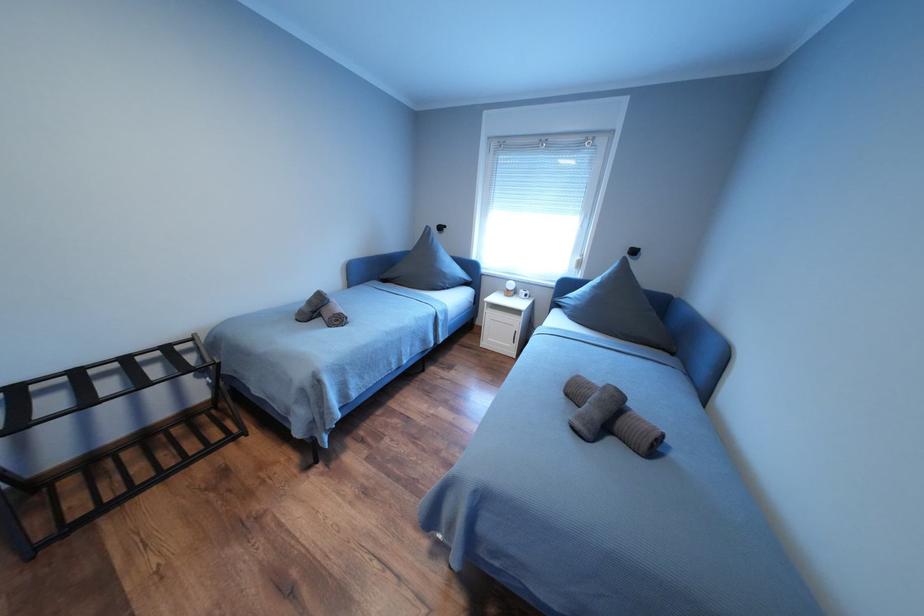
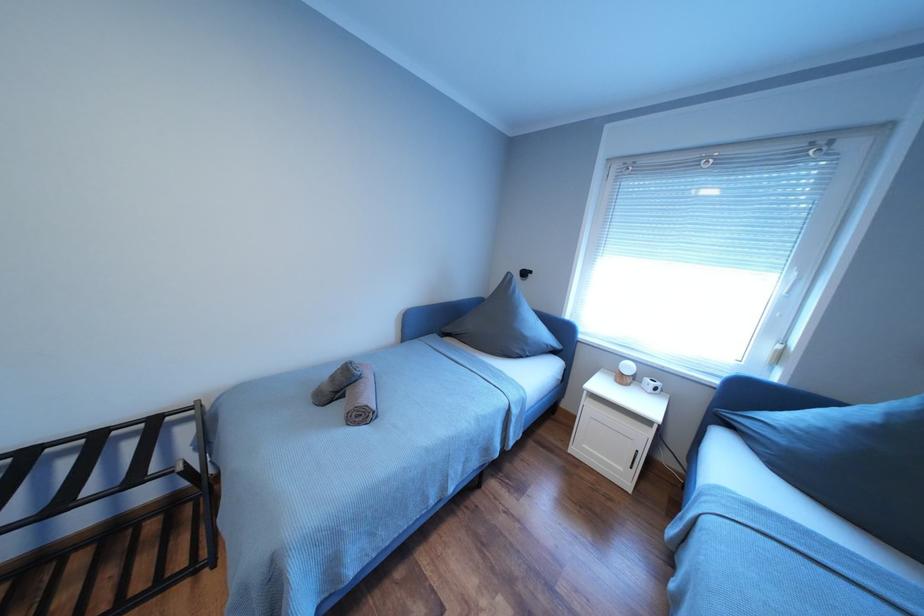
Question: What movement of the cameraman would produce the second image?

Choices:
 (A) Left
 (B) Right
 (C) Forward
 (D) Backward

Answer: (C)